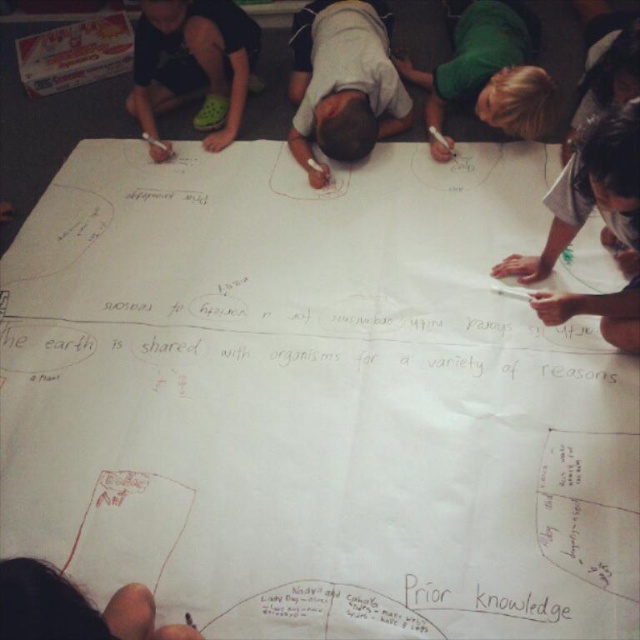
Between matte black shirt at upper left and black paper knowledge at lower center, which one has more height?

With more height is matte black shirt at upper left.

Is matte black shirt at upper left shorter than black paper knowledge at lower center?

No.

Which is behind, point (160, 24) or point (534, 612)?

The point (160, 24) is more distant.

In order to click on matte black shirt at upper left in this screenshot , I will do `click(193, 64)`.

Can you confirm if white matte shirt at center is positioned above dark gray shirt at lower right?

Indeed, white matte shirt at center is positioned over dark gray shirt at lower right.

Who is more distant from viewer, (339, 136) or (609, 332)?

The point (339, 136) is behind.

Where is `white matte shirt at center`? The height and width of the screenshot is (640, 640). white matte shirt at center is located at coordinates (342, 83).

This screenshot has width=640, height=640. What do you see at coordinates (342, 83) in the screenshot? I see `white matte shirt at center` at bounding box center [342, 83].

Does white matte shirt at center have a lesser height compared to matte black shirt at upper left?

In fact, white matte shirt at center may be taller than matte black shirt at upper left.

Between point (365, 58) and point (202, 74), which one is positioned in front?

Positioned in front is point (365, 58).

Where is `white matte shirt at center`? white matte shirt at center is located at coordinates (342, 83).